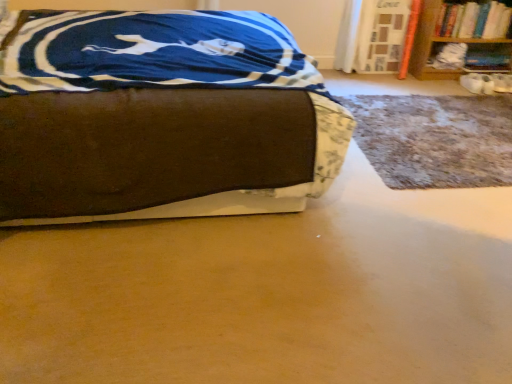
Question: Should I look upward or downward to see hardcover book at upper right?

Choices:
 (A) up
 (B) down

Answer: (A)

Question: Are brown fabric bed at center and wooden bookshelf at upper right located far from each other?

Choices:
 (A) yes
 (B) no

Answer: (A)

Question: Is wooden bookshelf at upper right completely or partially inside brown fabric bed at center?

Choices:
 (A) yes
 (B) no

Answer: (B)

Question: Is brown fabric bed at center behind wooden bookshelf at upper right?

Choices:
 (A) yes
 (B) no

Answer: (B)

Question: Is brown fabric bed at center located outside wooden bookshelf at upper right?

Choices:
 (A) yes
 (B) no

Answer: (A)

Question: From the image's perspective, does brown fabric bed at center appear lower than wooden bookshelf at upper right?

Choices:
 (A) yes
 (B) no

Answer: (A)

Question: Can you confirm if brown fabric bed at center is bigger than wooden bookshelf at upper right?

Choices:
 (A) no
 (B) yes

Answer: (B)

Question: Can you confirm if brown fabric bed at center is shorter than hardcover book at upper right?

Choices:
 (A) yes
 (B) no

Answer: (B)

Question: Is hardcover book at upper right surrounded by brown fabric bed at center?

Choices:
 (A) yes
 (B) no

Answer: (B)

Question: Is brown fabric bed at center smaller than hardcover book at upper right?

Choices:
 (A) yes
 (B) no

Answer: (B)

Question: Is brown fabric bed at center bigger than hardcover book at upper right?

Choices:
 (A) yes
 (B) no

Answer: (A)

Question: Is brown fabric bed at center located outside hardcover book at upper right?

Choices:
 (A) yes
 (B) no

Answer: (A)

Question: Is brown fabric bed at center at the left side of hardcover book at upper right?

Choices:
 (A) no
 (B) yes

Answer: (B)

Question: Can brown fabric bed at center be found inside hardcover book at upper right?

Choices:
 (A) no
 (B) yes

Answer: (A)